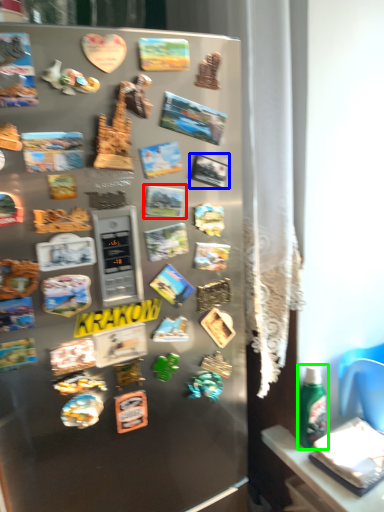
Question: Considering the real-world distances, which object is closest to comic book (highlighted by a red box)? comic book (highlighted by a blue box) or bottle (highlighted by a green box).

Choices:
 (A) comic book
 (B) bottle

Answer: (A)